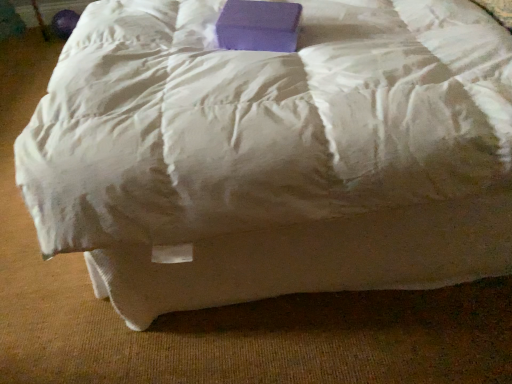
At what (x,y) coordinates should I click in order to perform the action: click on purple matte block at upper center. Please return your answer as a coordinate pair (x, y). This screenshot has height=384, width=512. Looking at the image, I should click on (258, 26).

What do you see at coordinates (258, 26) in the screenshot?
I see `purple matte block at upper center` at bounding box center [258, 26].

Identify the location of purple matte block at upper center. The height and width of the screenshot is (384, 512). (258, 26).